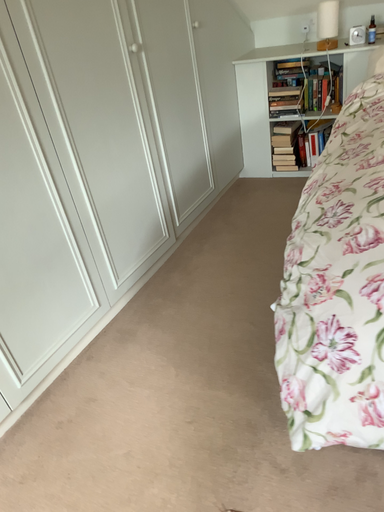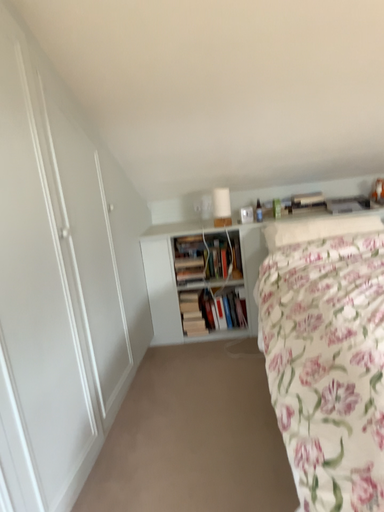
Question: How did the camera likely rotate when shooting the video?

Choices:
 (A) rotated downward
 (B) rotated upward

Answer: (B)